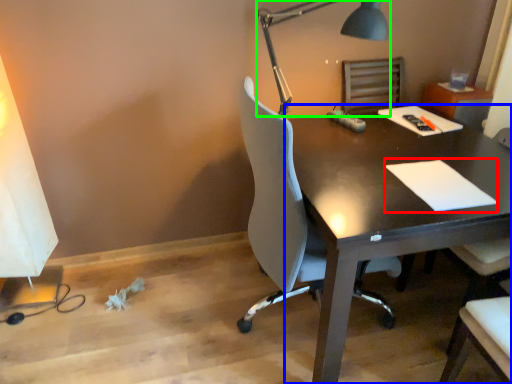
Question: Considering the real-world distances, which object is farthest from notepad (highlighted by a red box)? desk (highlighted by a blue box) or lamp (highlighted by a green box)?

Choices:
 (A) desk
 (B) lamp

Answer: (B)